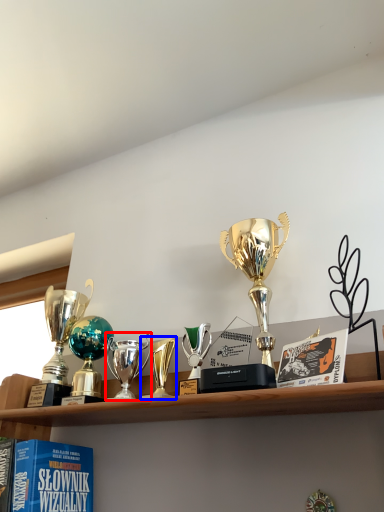
Question: Which object is closer to the camera taking this photo, trophy (highlighted by a red box) or trophy (highlighted by a blue box)?

Choices:
 (A) trophy
 (B) trophy

Answer: (B)